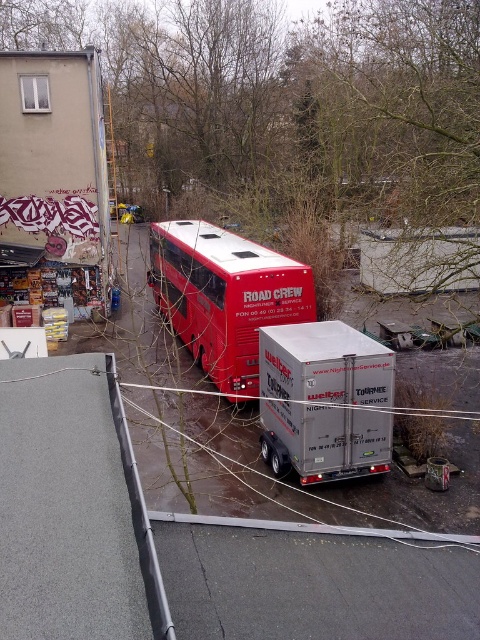
You are a delivery person needing to park your van between the silver metallic trailer at center and the shiny red bus at center. Can your van fit in the space between them?

A: The silver metallic trailer at center is shorter than the shiny red bus at center, so the space between them may be sufficient for your van. However, without knowing the exact dimensions of the van or the distance between the two vehicles, it is difficult to determine if it will fit. Consider measuring the available space before attempting to park.

You are a delivery driver who needs to park your 4.5 meter long truck in the alley. You see the silver metallic trailer at center and the shiny red bus at center. Is there enough space between them to park your truck?

The silver metallic trailer at center and the shiny red bus at center are 4.47 meters apart. Since your truck is 4.5 meters long, there is not enough space to park between them.

You are a delivery person trying to navigate through the alley where the red double decker bus and silver trailer are parked. You need to deliver a package to a location marked by point (315, 464) and point (271, 301). Which point is closer to your current position if you are standing at the entrance of the alley?

Point (315, 464) is closer to the camera than point (271, 301), so if you are at the entrance, point (315, 464) would be closer to your current position.